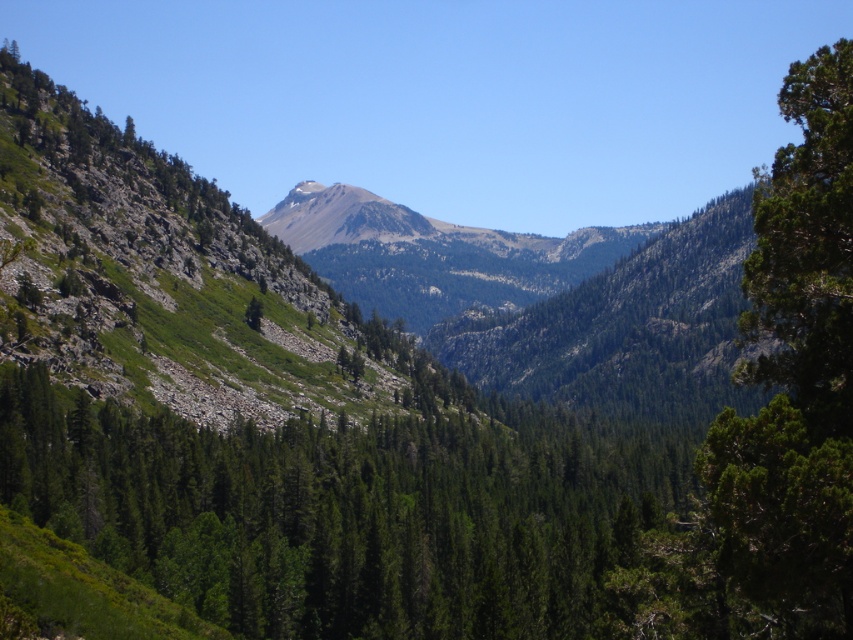
Question: Is green matte tree at center behind green textured tree at right?

Choices:
 (A) no
 (B) yes

Answer: (B)

Question: Does green matte tree at center appear on the left side of green textured tree at right?

Choices:
 (A) no
 (B) yes

Answer: (B)

Question: Is green matte tree at center positioned in front of green textured tree at right?

Choices:
 (A) yes
 (B) no

Answer: (B)

Question: Among these points, which one is nearest to the camera?

Choices:
 (A) (807, 230)
 (B) (314, 600)

Answer: (A)